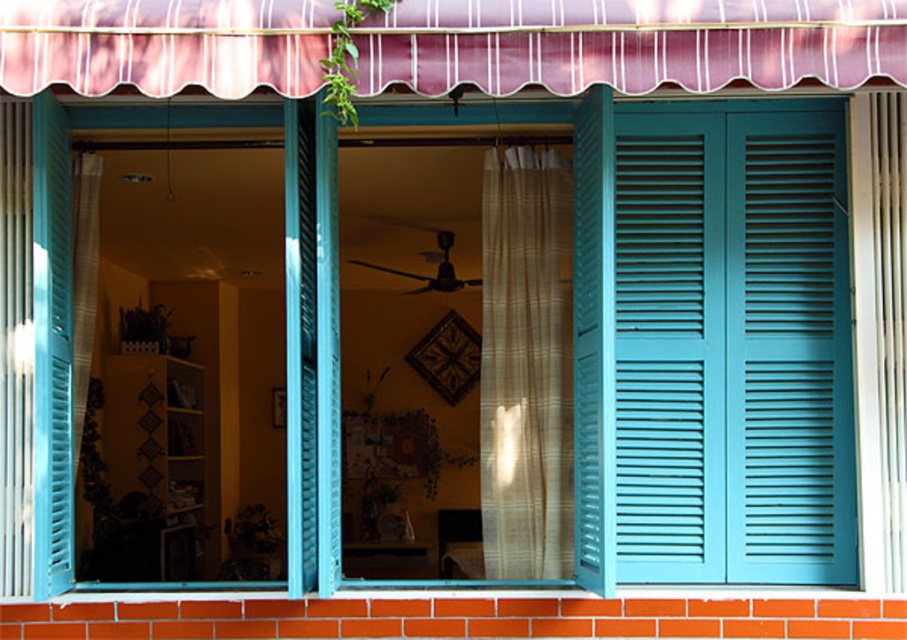
You are standing outside the window and want to see the ceiling fan inside. Which curtain should you look through to have a clear view? The translucent beige curtain at center or the translucent fabric curtain at left?

The translucent beige curtain at center is below the translucent fabric curtain at left. To see the ceiling fan, you should look through the translucent beige curtain at center since it is positioned lower and closer to your eye level when standing outside.